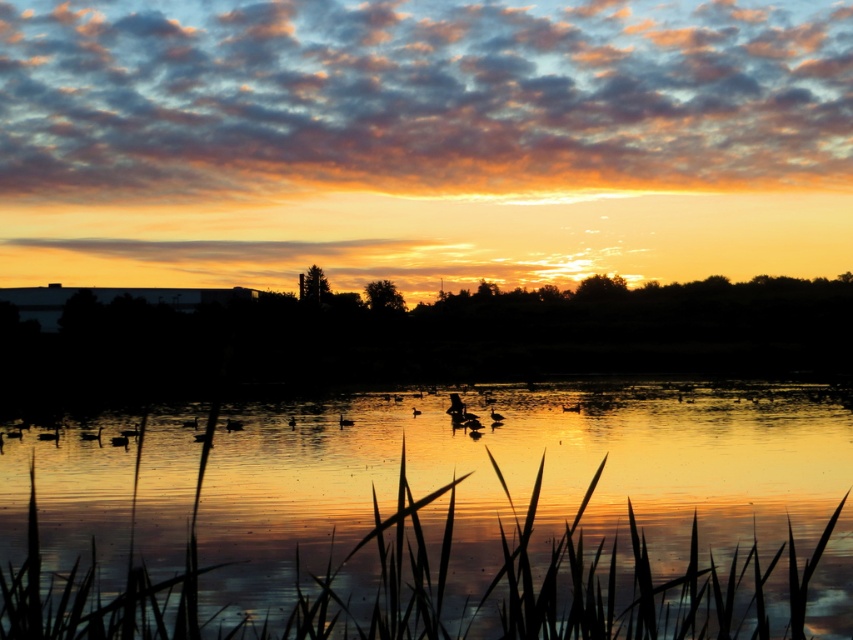
Does reflective golden water at center have a smaller size compared to silvery glossy duck at center?

Incorrect, reflective golden water at center is not smaller in size than silvery glossy duck at center.

Who is more distant from viewer, (811, 456) or (346, 422)?

The point (346, 422) is more distant.

At what (x,y) coordinates should I click in order to perform the action: click on reflective golden water at center. Please return your answer as a coordinate pair (x, y). The width and height of the screenshot is (853, 640). Looking at the image, I should click on (442, 525).

Consider the image. Can you confirm if reflective golden water at center is positioned below silhouette feathered duck at lower left?

Actually, reflective golden water at center is above silhouette feathered duck at lower left.

You are a GUI agent. You are given a task and a screenshot of the screen. Output one action in this format:
    pyautogui.click(x=<x>, y=<y>)
    Task: Click on the reflective golden water at center
    This screenshot has width=853, height=640.
    Given the screenshot: What is the action you would take?
    pyautogui.click(x=442, y=525)

Between silhouette feathered duck at lower left and silvery glossy duck at center, which one is positioned higher?

Positioned higher is silvery glossy duck at center.

Does point (38, 435) come closer to viewer compared to point (339, 424)?

Yes, point (38, 435) is closer to viewer.

Based on the photo, who is more distant from viewer, (x=51, y=433) or (x=341, y=413)?

The point (x=341, y=413) is more distant.

At what (x,y) coordinates should I click in order to perform the action: click on silhouette feathered duck at lower left. Please return your answer as a coordinate pair (x, y). The image size is (853, 640). Looking at the image, I should click on (50, 435).